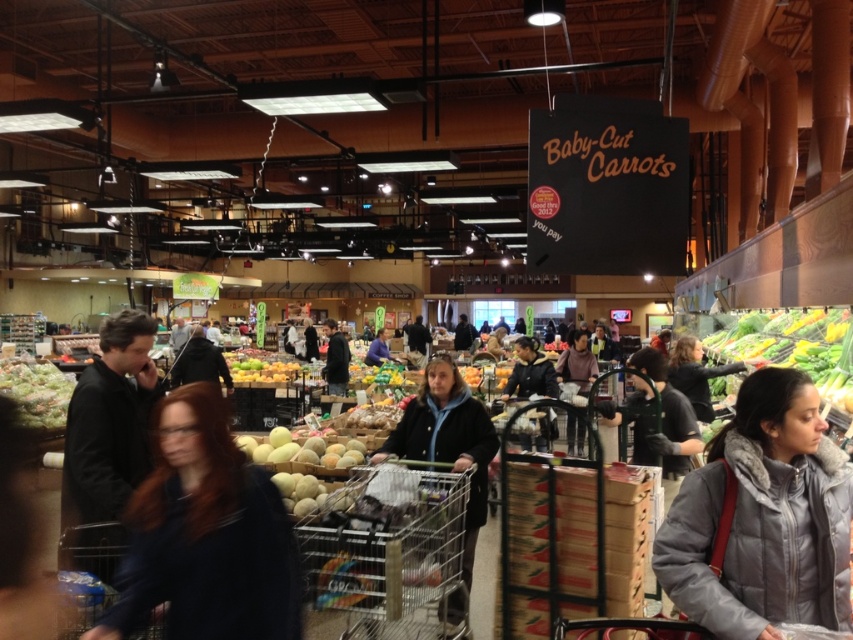
You are navigating the grocery store and need to reach a specific item located at point [805,380]. Currently, you are at point [225,500]. According to the store layout, which direction should you move to get closer to your destination?

To reach point [805,380] from point [225,500], you should move upward because point [805,380] is behind point [225,500], indicating it is in the upper direction relative to your current position.